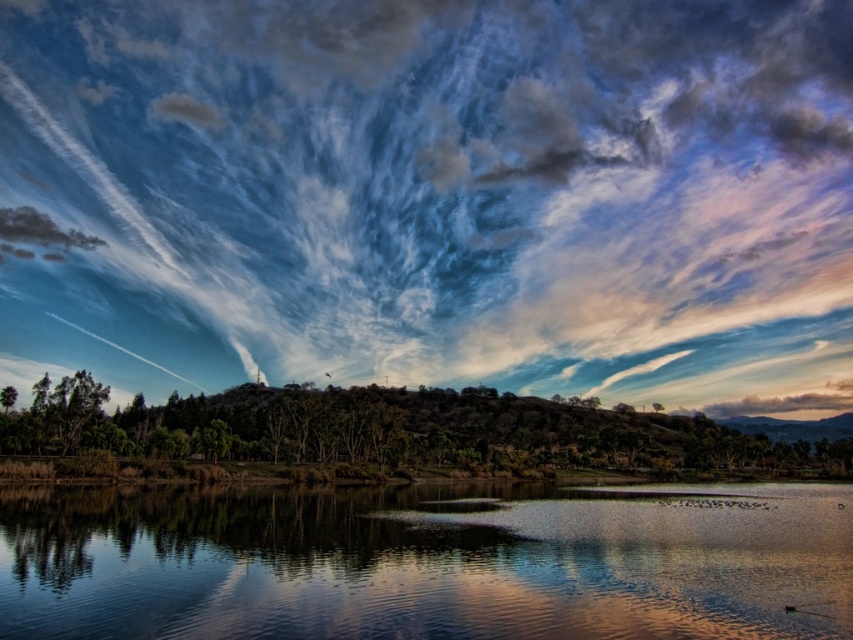
You are standing at the waterline observing the two points marked in the image. Which point, point [764,516] or point [352,392], is nearer to your current position?

Point [764,516] is closer to the camera than point [352,392], so it is nearer to your current position.

You are standing at the waterline and see the cloudy sky at center and the green matte tree at center. Which one is located to the left when facing the scene?

The cloudy sky at center is positioned on the left side of green matte tree at center, so when facing the scene, the cloudy sky at center is to the left of the green matte tree at center.